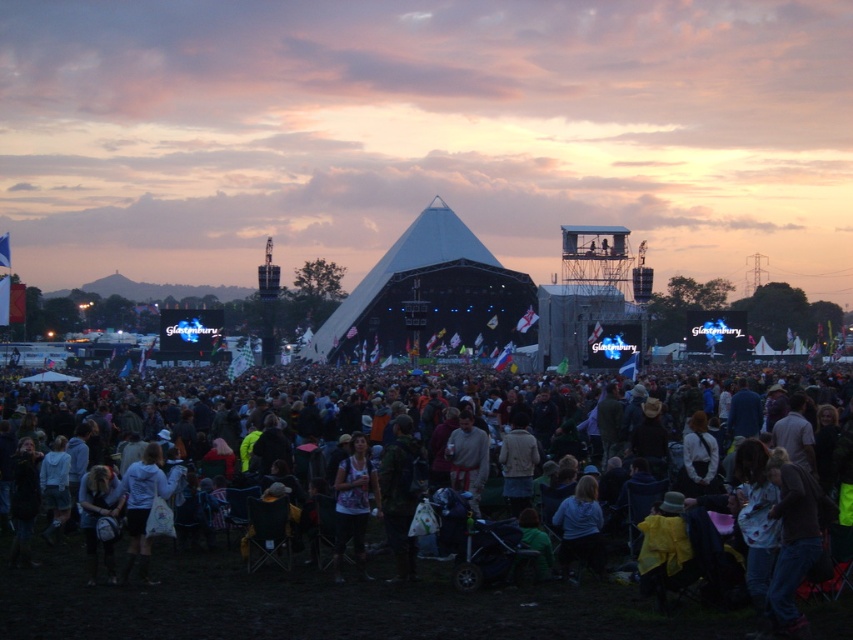
Question: Is dark casual clothing at center positioned in front of printed fabric shirt at center?

Choices:
 (A) yes
 (B) no

Answer: (A)

Question: Which of the following is the farthest from the observer?

Choices:
 (A) (367, 508)
 (B) (102, 595)

Answer: (A)

Question: Among these objects, which one is nearest to the camera?

Choices:
 (A) dark casual clothing at center
 (B) printed fabric shirt at center

Answer: (A)

Question: Does dark casual clothing at center come behind printed fabric shirt at center?

Choices:
 (A) yes
 (B) no

Answer: (B)

Question: Observing the image, what is the correct spatial positioning of dark casual clothing at center in reference to printed fabric shirt at center?

Choices:
 (A) below
 (B) above

Answer: (B)